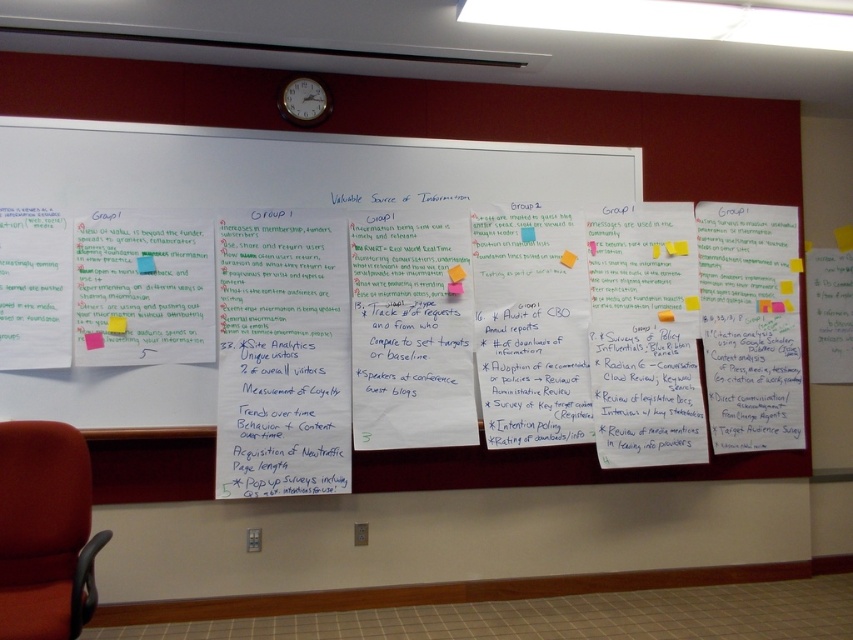
Does white paperboard at center have a greater width compared to matte blue sticky note at left?

Yes.

Looking at this image, can you confirm if white paperboard at center is smaller than matte blue sticky note at left?

Incorrect, white paperboard at center is not smaller in size than matte blue sticky note at left.

Does point (550, 193) come in front of point (136, 259)?

That is False.

Locate an element on the screen. white paperboard at center is located at coordinates (289, 170).

Is point (146, 376) farther from viewer compared to point (109, 330)?

Yes, point (146, 376) is farther from viewer.

Who is more forward, [57,129] or [115,326]?

Point [115,326] is in front.

Identify the location of white paperboard at center. The height and width of the screenshot is (640, 853). (289, 170).

Is metallic silver clock at upper center shorter than orange sticky note at center-right?

No, metallic silver clock at upper center is not shorter than orange sticky note at center-right.

Does metallic silver clock at upper center have a greater width compared to orange sticky note at center-right?

Yes, metallic silver clock at upper center is wider than orange sticky note at center-right.

Does point (305, 77) come closer to viewer compared to point (563, 253)?

Yes, point (305, 77) is in front of point (563, 253).

Find the location of a particular element. metallic silver clock at upper center is located at coordinates (303, 100).